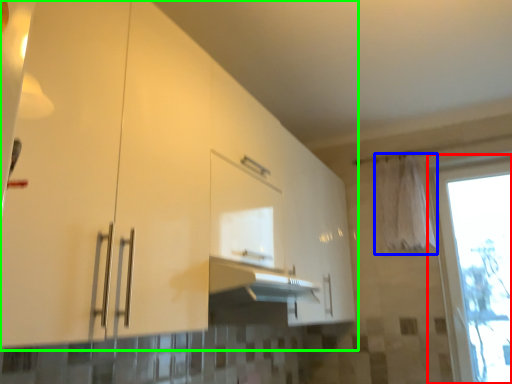
Question: Which is nearer to the window (highlighted by a red box)? curtain (highlighted by a blue box) or cabinetry (highlighted by a green box).

Choices:
 (A) curtain
 (B) cabinetry

Answer: (A)